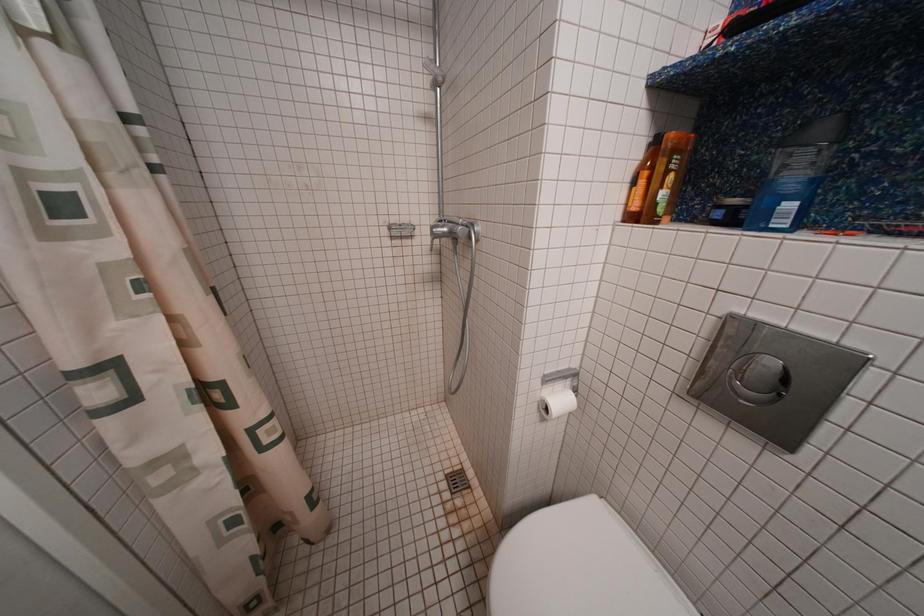
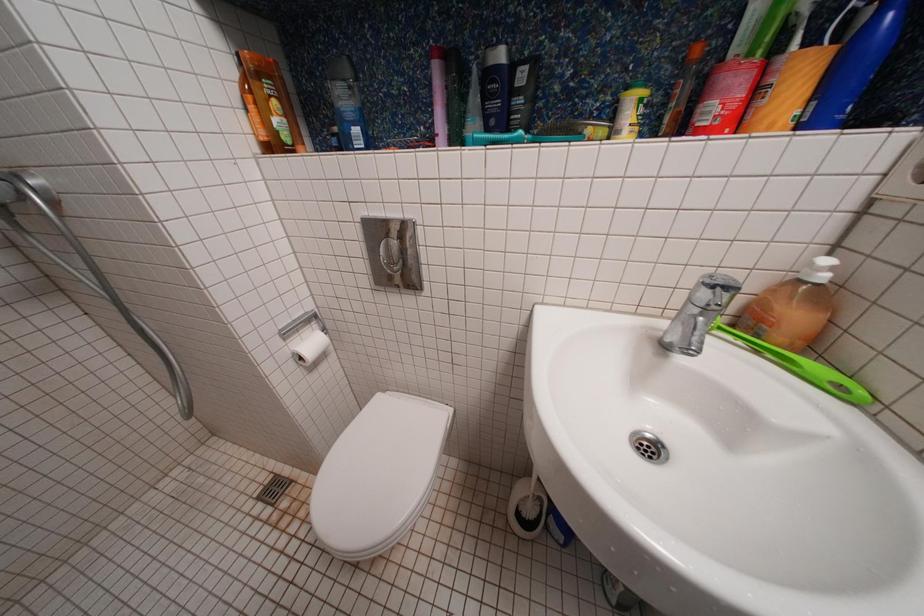
The first image is from the beginning of the video and the second image is from the end. How did the camera likely rotate when shooting the video?

The rotation direction of the camera is right-down.